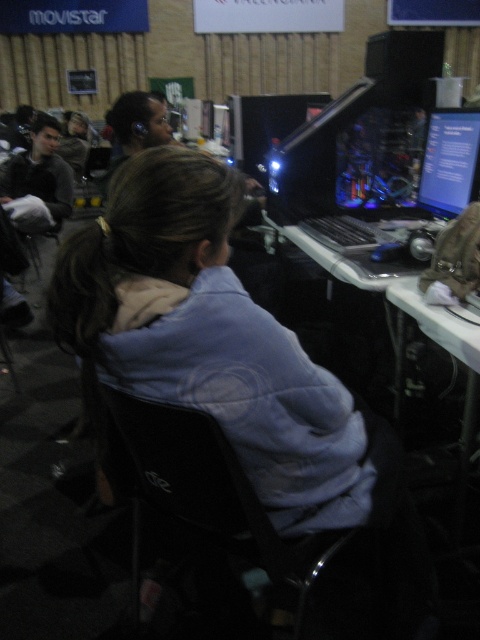
You are a security guard in the convention center and need to locate the light blue fleece at center. According to the coordinates provided, where would you find it?

The light blue fleece at center is located at coordinates point (x=210, y=339).

You are a person who wants to sit on the black fabric chair at center while wearing a hat that is 15 cm tall. The hat is currently on top of the light blue fleece at center. Can you safely sit down without hitting your head on anything?

The light blue fleece at center is taller than the black fabric chair at center. Since the hat is 15 cm tall and placed on top of the taller object, when you sit, the hat might extend above the chair. However, since the fleece is already taller, there might be enough clearance. But without knowing the exact height difference between the fleece and chair, it is hard to determine. However, the description only states the fleece is taller, not by how much. Therefore, it is uncertain if the 15 cm hat will fit.

You are a person who is 1.8 meters tall and want to see the matte black monitor at upper right from your seat in the black fabric chair at center. Considering the height difference between the two objects, will you be able to see the monitor without needing to stand up?

The black fabric chair at center is much taller than the matte black monitor at upper right, so sitting in the chair you might have difficulty seeing the monitor clearly without adjusting your position or standing up.